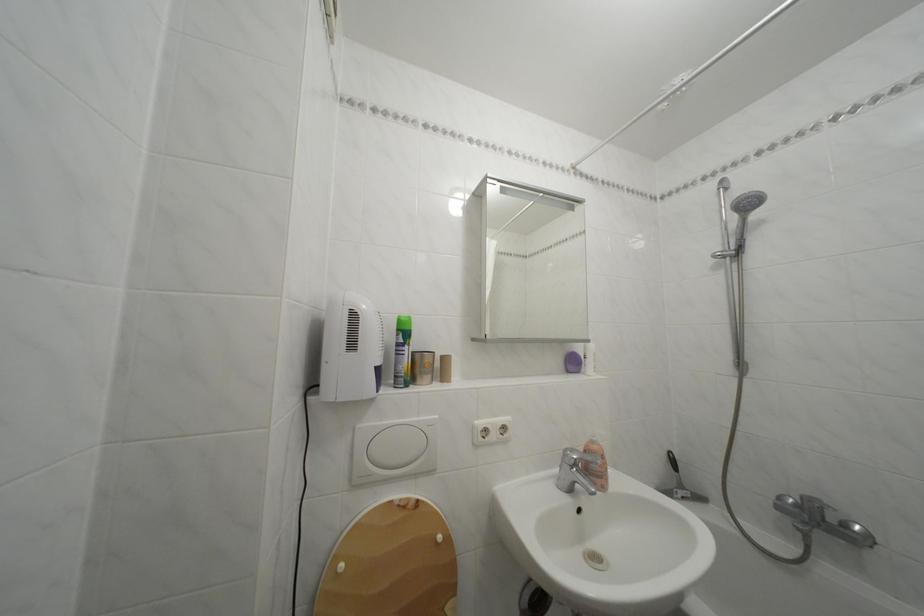
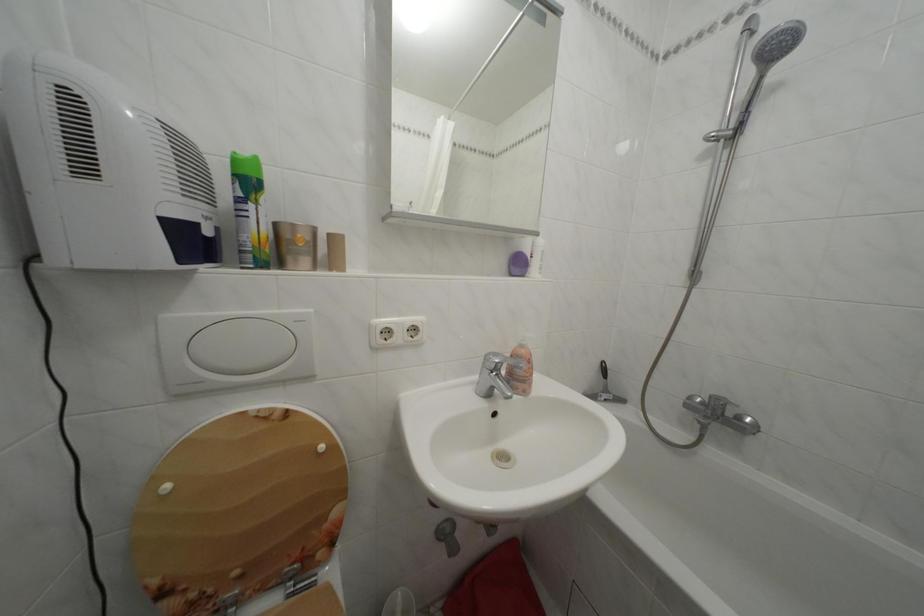
In the second image, find the point that corresponds to the point at 743,254 in the first image.

(742, 132)